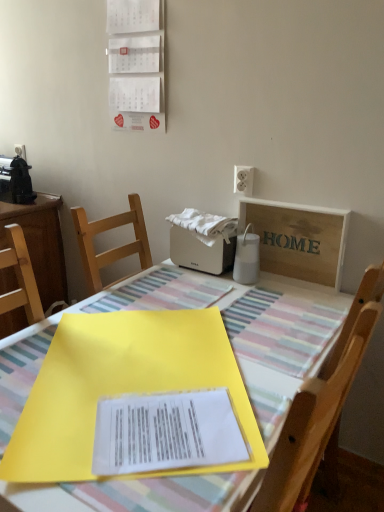
Question: In terms of width, does black plastic toaster at left, the 2th appliance from the right, look wider or thinner when compared to wooden sign at upper right?

Choices:
 (A) wide
 (B) thin

Answer: (A)

Question: In the image, is black plastic toaster at left, positioned as the first appliance in top-to-bottom order, positioned in front of or behind wooden sign at upper right?

Choices:
 (A) behind
 (B) front

Answer: (A)

Question: Which is nearer to the white paper calendar at upper center?

Choices:
 (A) yellow paper at center
 (B) black plastic toaster at left, marked as the 2th appliance in a front-to-back arrangement
 (C) white plastic toaster at center, the 1th appliance from the front
 (D) wooden sign at upper right
 (E) wooden chair at center

Answer: (C)

Question: Based on their relative distances, which object is nearer to the white paper calendar at upper center?

Choices:
 (A) black plastic toaster at left, which is the second appliance from bottom to top
 (B) white cotton towel at center
 (C) white plastic toaster at center, arranged as the 2th appliance when viewed from the left
 (D) wooden sign at upper right
 (E) yellow plastic folder at center

Answer: (B)